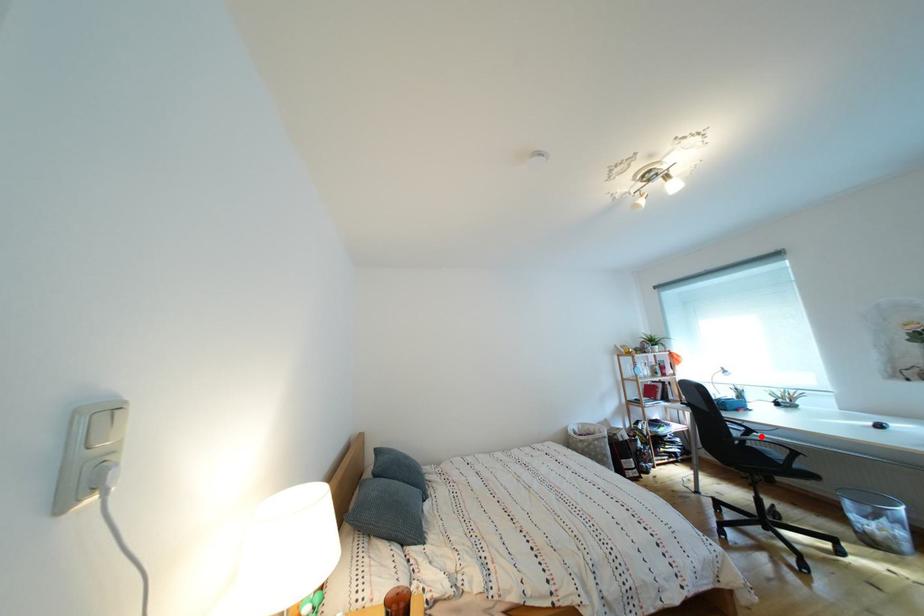
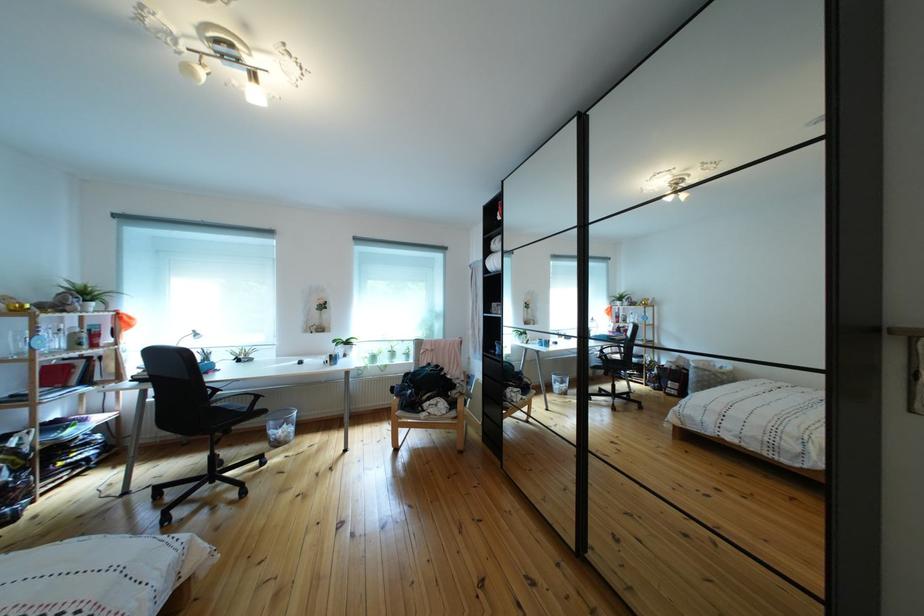
Locate, in the second image, the point that corresponds to the highlighted location in the first image.

(227, 395)